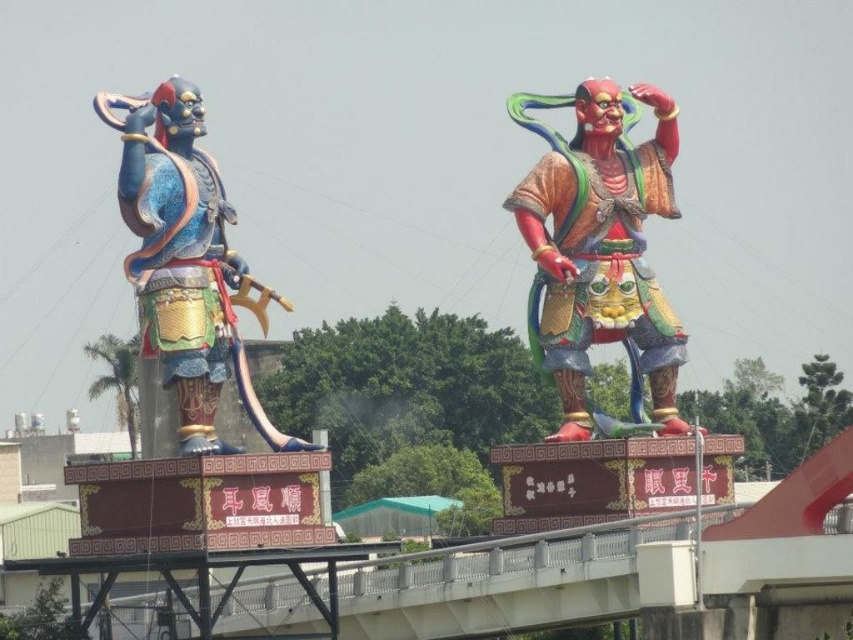
You are a tourist standing on the bridge and want to take a photo of both the glossy painted statue at right and the shiny blue armor at left. However, the bridge is narrow. Which statue should you stand closer to in order to capture both in your frame without moving your position?

You should stand closer to the shiny blue armor at left because the glossy painted statue at right is positioned over it, meaning the glossy painted statue at right is farther away. By standing closer to the nearer statue, you can include both in your photo without moving.

You are standing at the base of the bridge and want to reach the point marked at coordinates [541,196]. The bridge is 500 feet long. Is the point within the bridge length?

The point at coordinates [541,196] is 420.60 feet away from the viewer, which is within the 500 feet length of the bridge. Therefore, the point is within the bridge length.